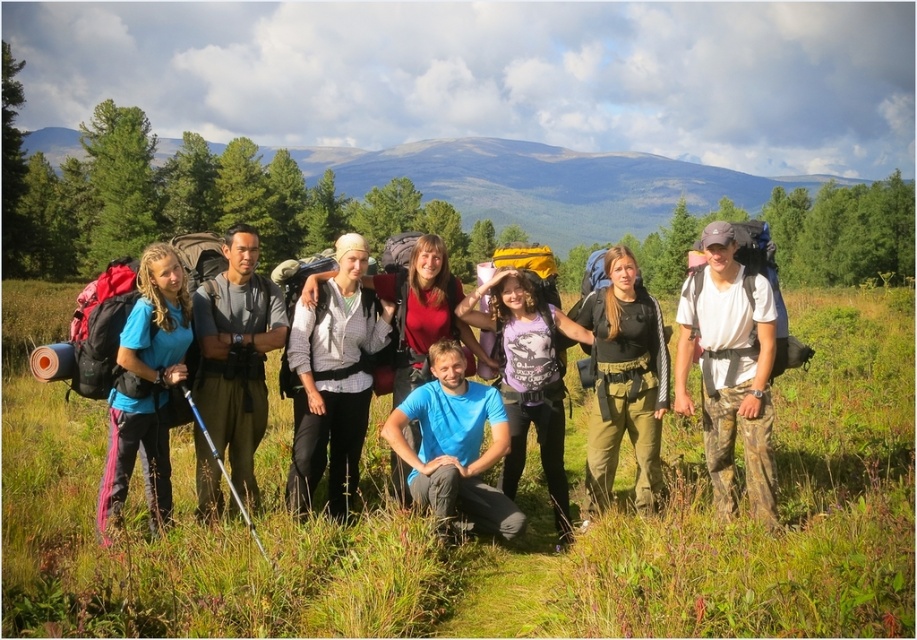
You are part of the hiking group and want to take a photo of the black matte shirt at center and the teal matte shirt at left. Since you are standing where the photographer is, which one would appear closer to you in the photo?

The black matte shirt at center would appear closer to you in the photo because it is positioned further to the viewer than the teal matte shirt at left.